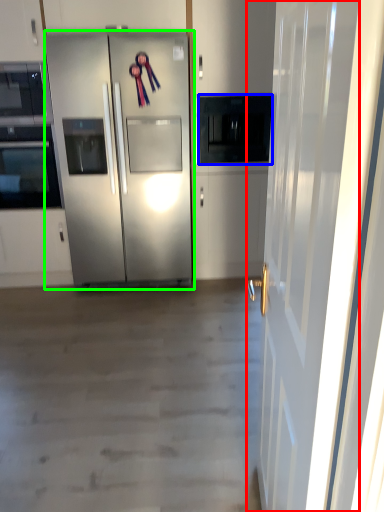
Question: Which object is positioned closest to door (highlighted by a red box)? Select from appliance (highlighted by a blue box) and refrigerator (highlighted by a green box).

Choices:
 (A) appliance
 (B) refrigerator

Answer: (B)